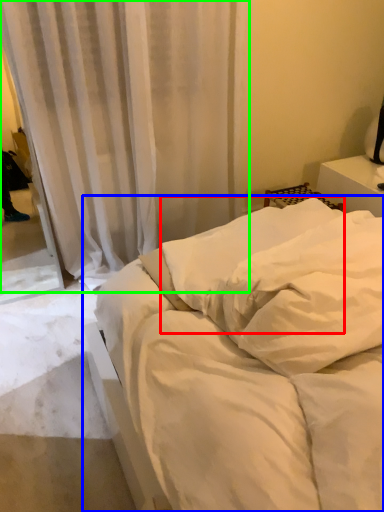
Question: Considering the real-world distances, which object is farthest from pillow (highlighted by a red box)? bed (highlighted by a blue box) or curtain (highlighted by a green box)?

Choices:
 (A) bed
 (B) curtain

Answer: (B)